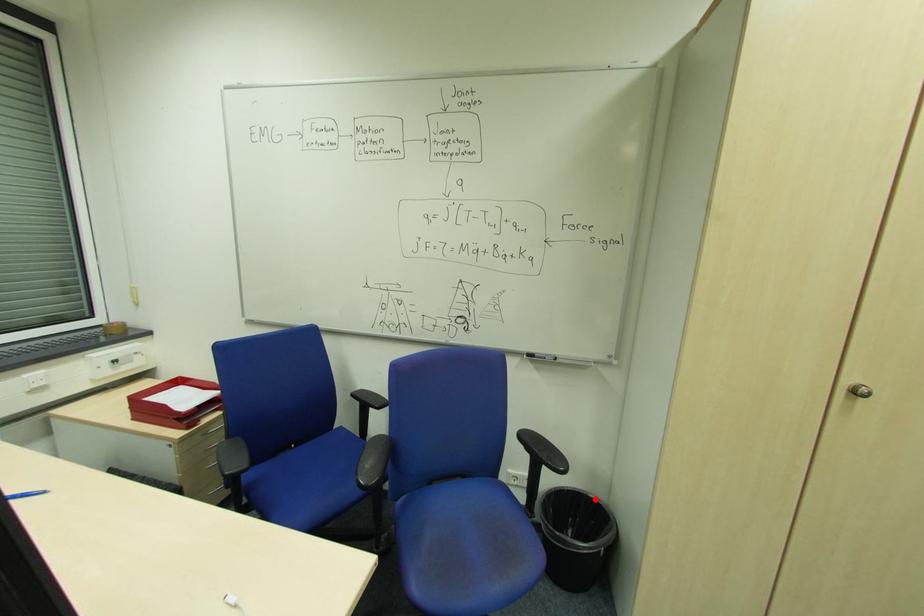
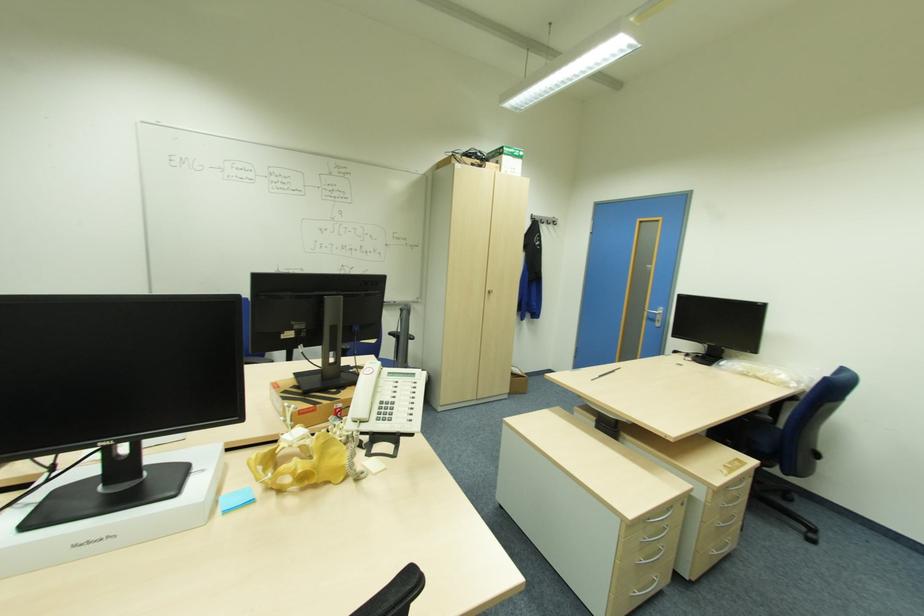
Question: I am providing you with two images of the same scene from different viewpoints. A red point is marked on the first image. Can you still see the location of the red point in image 2?

Choices:
 (A) Yes
 (B) No

Answer: (B)